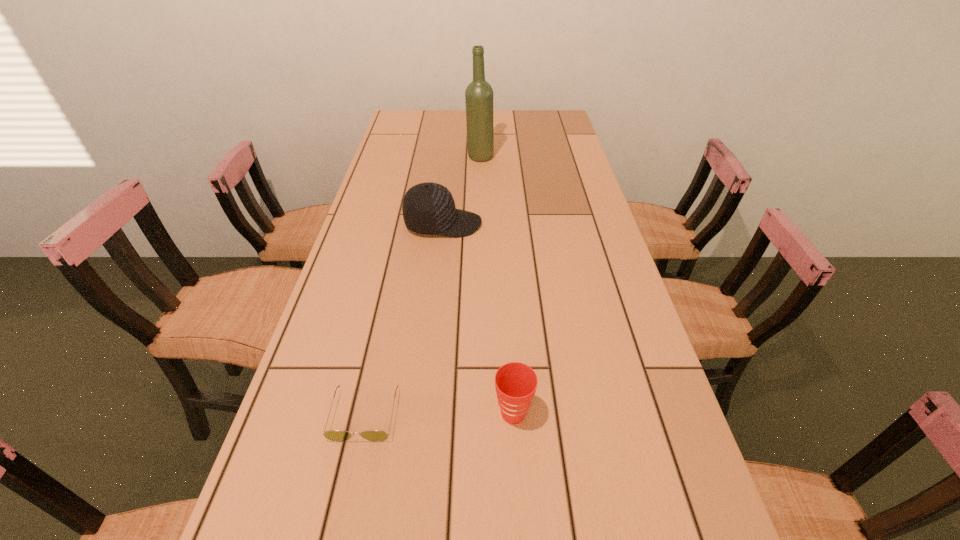
Locate an element on the screen. The height and width of the screenshot is (540, 960). vacant region that satisfies the following two spatial constraints: 1. at the front of the baseball cap where the brim is located; 2. on the front-facing side of the sunglasses is located at coordinates (422, 414).